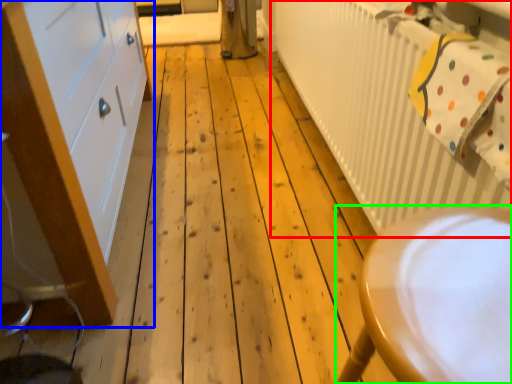
Question: Which is farther away from radiator (highlighted by a red box)? cabinetry (highlighted by a blue box) or furniture (highlighted by a green box)?

Choices:
 (A) cabinetry
 (B) furniture

Answer: (A)